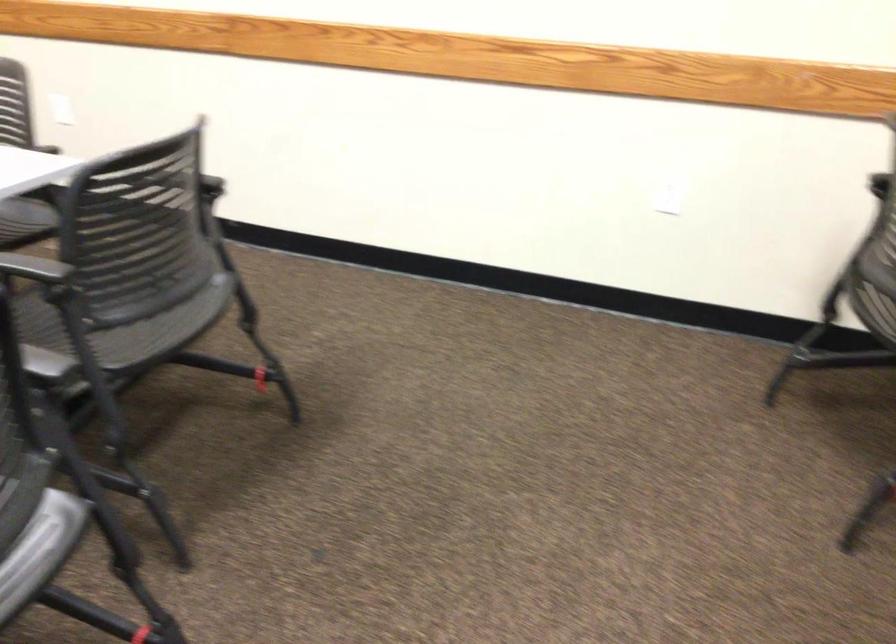
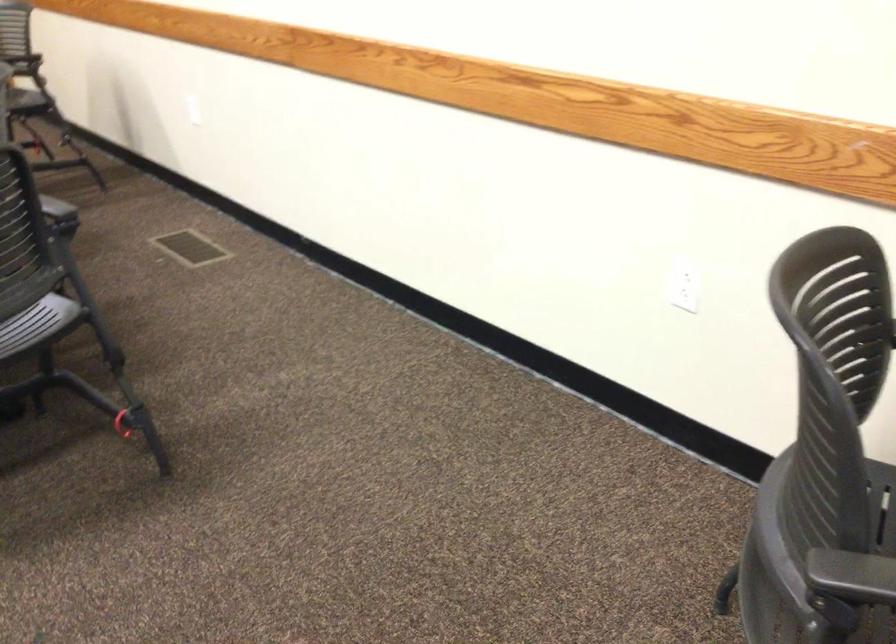
Locate, in the second image, the point that corresponds to pixel 191 187 in the first image.

(56, 207)